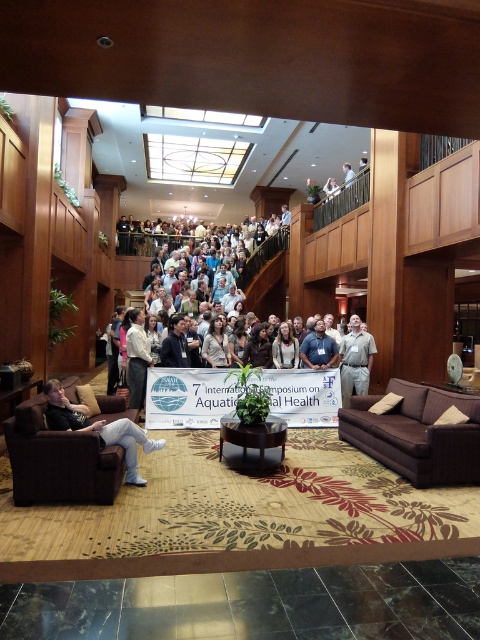
Question: Is white shirt at center bigger than light brown wooden chair at upper center?

Choices:
 (A) yes
 (B) no

Answer: (A)

Question: Which point appears closest to the camera in this image?

Choices:
 (A) (350, 388)
 (B) (132, 355)

Answer: (B)

Question: Can you confirm if dark gray fabric couch at lower left is positioned to the right of light blue shirt at center?

Choices:
 (A) yes
 (B) no

Answer: (B)

Question: Based on their relative distances, which object is nearer to the light gray uniform at center?

Choices:
 (A) light blue shirt at center
 (B) dark gray fabric couch at lower left
 (C) white fabric at upper center

Answer: (A)

Question: Estimate the real-world distances between objects in this image. Which object is closer to the light brown wooden chair at upper center?

Choices:
 (A) dark gray fabric couch at lower left
 (B) light blue shirt at center
 (C) light gray uniform at center
 (D) white fabric at upper center

Answer: (D)

Question: Is light gray uniform at center wider than white fabric at upper center?

Choices:
 (A) yes
 (B) no

Answer: (A)